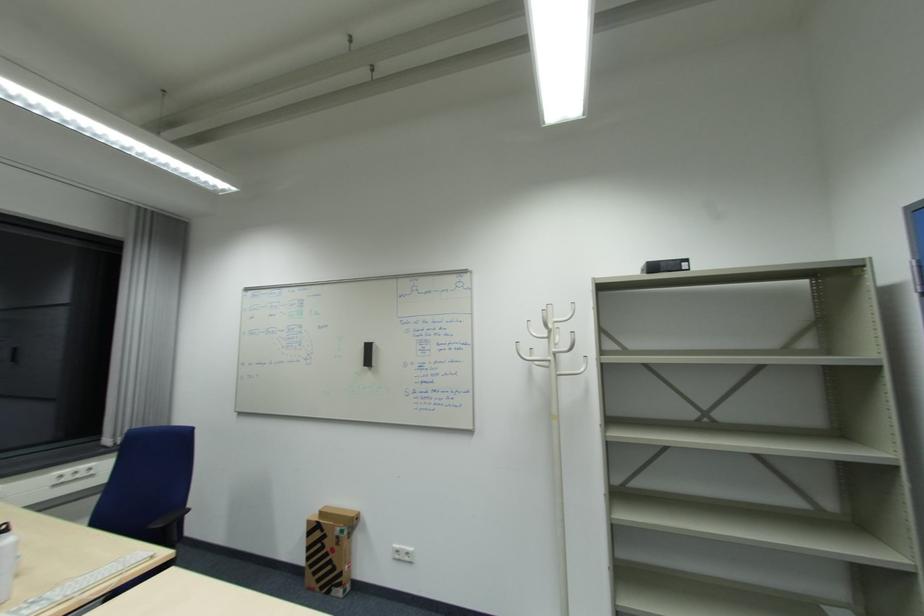
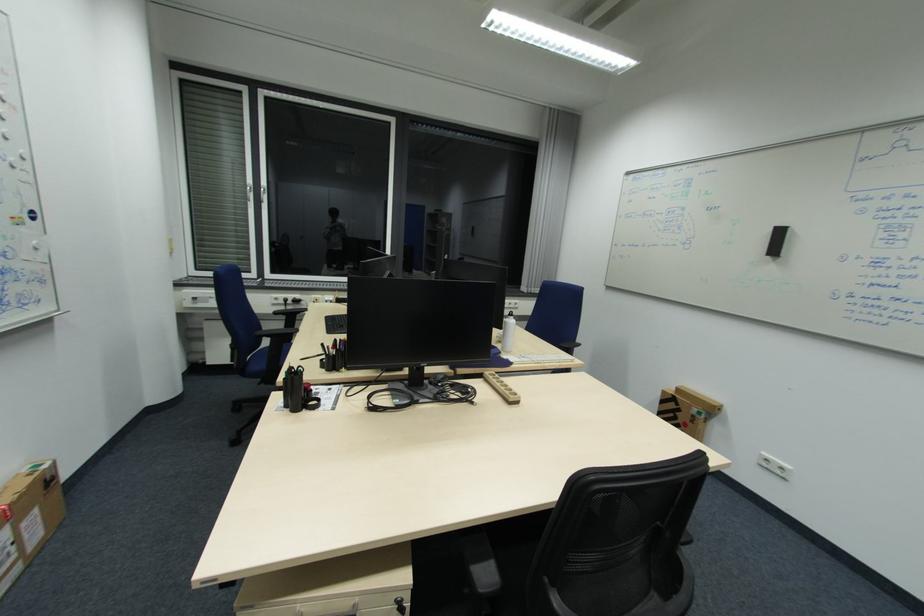
Based on the continuous images, in which direction is the camera rotating?

The camera's rotation is toward left-down.